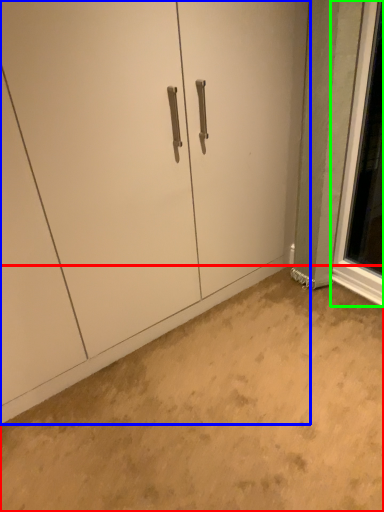
Question: Which object is the closest to the concrete (highlighted by a red box)? Choose among these: door (highlighted by a blue box) or window (highlighted by a green box).

Choices:
 (A) door
 (B) window

Answer: (A)